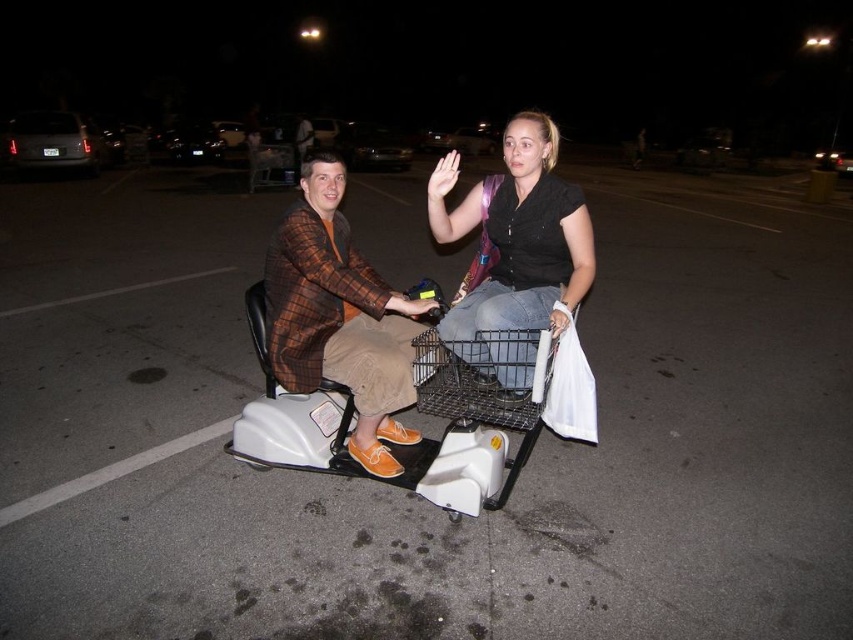
Does brown plaid jacket at center come behind matte black shirt at center?

Yes, it is behind matte black shirt at center.

Is brown plaid jacket at center below matte black shirt at center?

Yes, brown plaid jacket at center is below matte black shirt at center.

This screenshot has height=640, width=853. In order to click on brown plaid jacket at center in this screenshot , I will do `click(340, 317)`.

Between matte black scooter at center and brown plaid jacket at center, which one has less height?

With less height is brown plaid jacket at center.

Is matte black scooter at center below brown plaid jacket at center?

Incorrect, matte black scooter at center is not positioned below brown plaid jacket at center.

Is point (451, 225) closer to viewer compared to point (305, 220)?

No, it is not.

Where is `matte black scooter at center`? matte black scooter at center is located at coordinates (515, 241).

Is matte black scooter at center closer to camera compared to matte black shirt at center?

That is True.

Is point (445, 160) more distant than point (432, 202)?

Yes.

Locate an element on the screen. The height and width of the screenshot is (640, 853). matte black scooter at center is located at coordinates (515, 241).